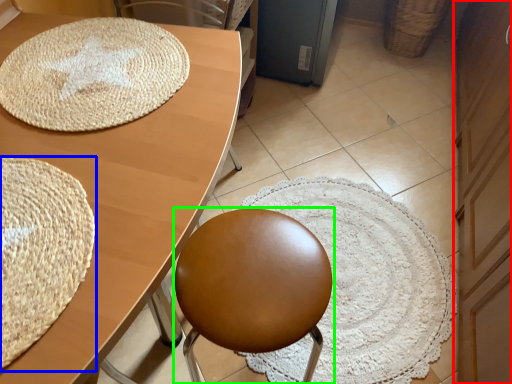
Question: Estimate the real-world distances between objects in this image. Which object is farther from dresser (highlighted by a red box), mat (highlighted by a blue box) or chair (highlighted by a green box)?

Choices:
 (A) mat
 (B) chair

Answer: (A)